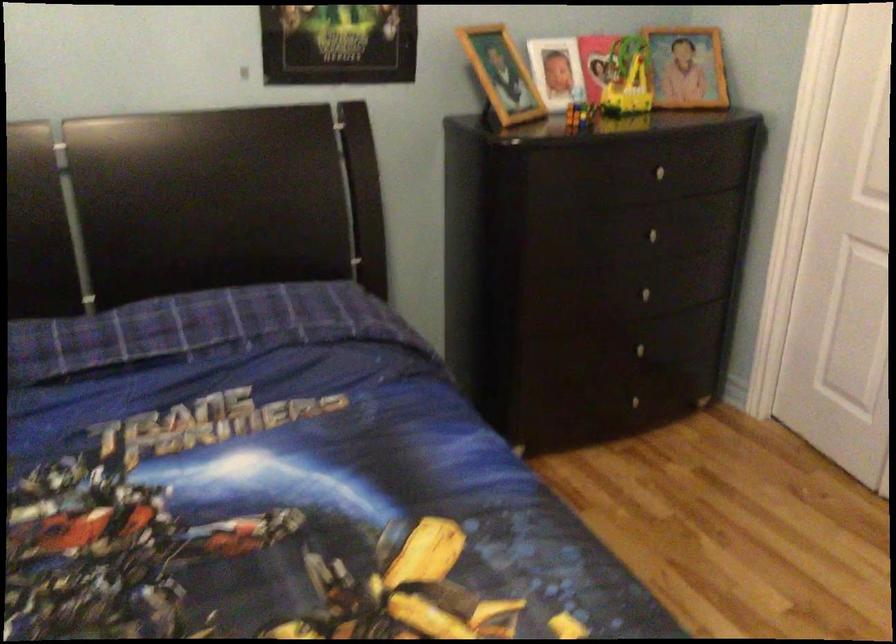
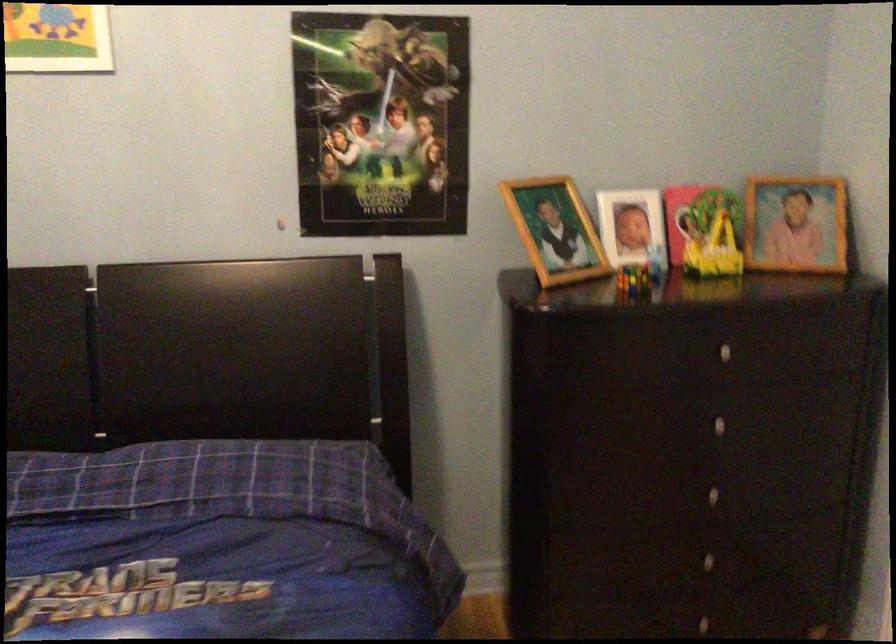
The point at [643,313] is marked in the first image. Where is the corresponding point in the second image?

(711, 516)